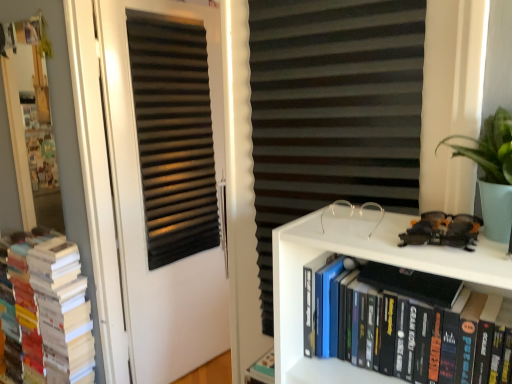
Question: Is white paper books at left, which is counted as the second book, starting from the front, wider than black matte bookshelf at lower right, which is counted as the second book, starting from the left?

Choices:
 (A) no
 (B) yes

Answer: (B)

Question: Is white paper books at left, placed as the first book when sorted from back to front, beside black matte bookshelf at lower right, which is the 1th book from front to back?

Choices:
 (A) no
 (B) yes

Answer: (A)

Question: Does white paper books at left, which is counted as the second book, starting from the front, come in front of black matte bookshelf at lower right, which is the 1th book from front to back?

Choices:
 (A) yes
 (B) no

Answer: (B)

Question: Can you confirm if white paper books at left, which is counted as the second book, starting from the front, is taller than black matte bookshelf at lower right, which is the 2th book in back-to-front order?

Choices:
 (A) no
 (B) yes

Answer: (B)

Question: Is white paper books at left, which is counted as the second book, starting from the front, positioned with its back to black matte bookshelf at lower right, which is the first book in right-to-left order?

Choices:
 (A) yes
 (B) no

Answer: (B)

Question: Considering the positions of point (411, 223) and point (217, 82), is point (411, 223) closer or farther from the camera than point (217, 82)?

Choices:
 (A) closer
 (B) farther

Answer: (A)

Question: From a real-world perspective, is shiny plastic toy car at upper right physically located above or below black matte door at center?

Choices:
 (A) above
 (B) below

Answer: (A)

Question: Considering the relative positions of shiny plastic toy car at upper right and black matte door at center in the image provided, is shiny plastic toy car at upper right to the left or to the right of black matte door at center?

Choices:
 (A) left
 (B) right

Answer: (B)

Question: Is shiny plastic toy car at upper right spatially inside black matte door at center, or outside of it?

Choices:
 (A) outside
 (B) inside

Answer: (A)

Question: In the image, is black matte door at center positioned in front of or behind shiny plastic toy car at upper right?

Choices:
 (A) front
 (B) behind

Answer: (B)

Question: From the image's perspective, is black matte door at center above or below shiny plastic toy car at upper right?

Choices:
 (A) above
 (B) below

Answer: (B)

Question: Considering the positions of black matte door at center and shiny plastic toy car at upper right in the image, is black matte door at center taller or shorter than shiny plastic toy car at upper right?

Choices:
 (A) tall
 (B) short

Answer: (A)

Question: Looking at the image, does black matte door at center seem bigger or smaller compared to shiny plastic toy car at upper right?

Choices:
 (A) small
 (B) big

Answer: (B)

Question: Is shiny plastic toy car at upper right bigger or smaller than black matte bookshelf at lower right, which is the 1th book from front to back?

Choices:
 (A) small
 (B) big

Answer: (A)

Question: Is shiny plastic toy car at upper right situated inside black matte bookshelf at lower right, which is the first book in right-to-left order, or outside?

Choices:
 (A) inside
 (B) outside

Answer: (B)